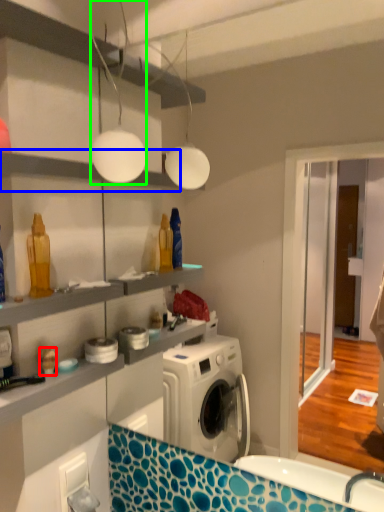
Question: Which object is positioned farthest from toy (highlighted by a red box)? Select from shelf (highlighted by a blue box) and light fixture (highlighted by a green box).

Choices:
 (A) shelf
 (B) light fixture

Answer: (B)